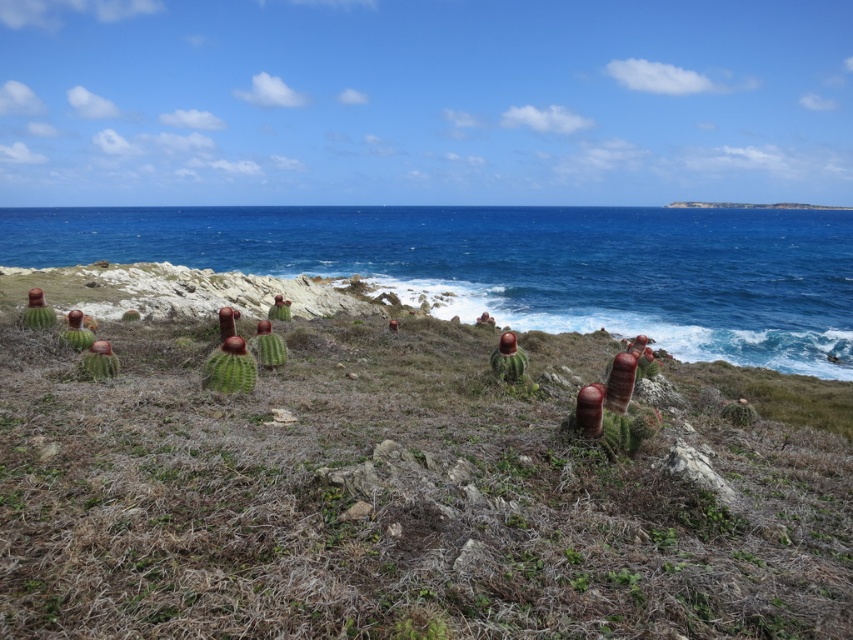
Between green grassy at center and blue water at center, which one has less height?

green grassy at center

Does point (129, 452) come farther from viewer compared to point (265, 253)?

No, (129, 452) is closer to viewer.

Identify the location of green grassy at center. Image resolution: width=853 pixels, height=640 pixels. (396, 500).